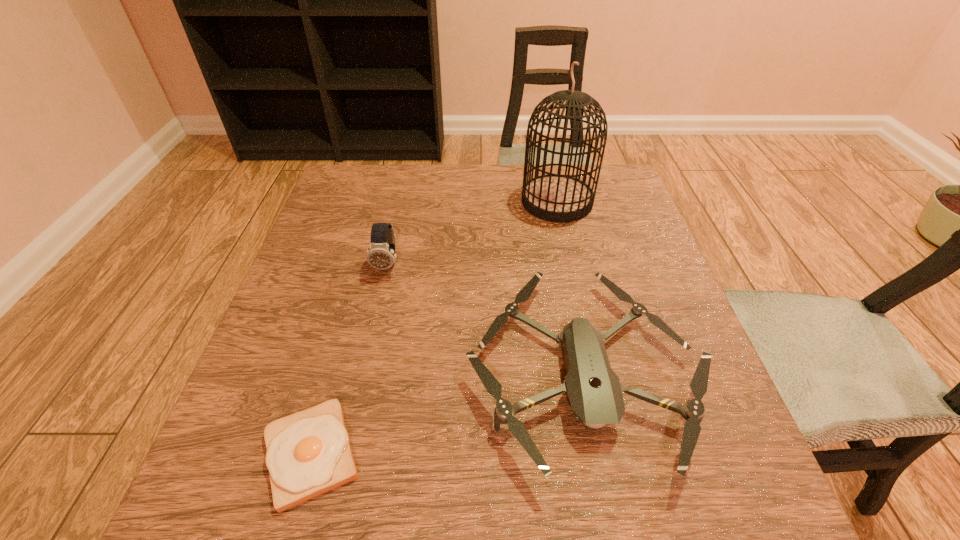
Identify the location of vacant space at the right edge of the desktop. This screenshot has height=540, width=960. (643, 303).

In order to click on vacant space at the far left corner of the desktop in this screenshot , I will do `click(365, 176)`.

I want to click on vacant area at the near left corner, so click(x=213, y=509).

In the image, there is a desktop. Where is `free space at the far right corner`? free space at the far right corner is located at coordinates (615, 209).

Where is `free area in between the farthest object and the second farthest object`? Image resolution: width=960 pixels, height=540 pixels. free area in between the farthest object and the second farthest object is located at coordinates (472, 233).

Where is `vacant area that lies between the shortest object and the farthest object`? The height and width of the screenshot is (540, 960). vacant area that lies between the shortest object and the farthest object is located at coordinates (434, 328).

This screenshot has height=540, width=960. Find the location of `free space between the shortest object and the drone`. free space between the shortest object and the drone is located at coordinates (447, 411).

You are a GUI agent. You are given a task and a screenshot of the screen. Output one action in this format:
    pyautogui.click(x=<x>, y=<y>)
    Task: Click on the free space between the second shortest object and the third shortest object
    Image resolution: width=960 pixels, height=540 pixels.
    Given the screenshot: What is the action you would take?
    pyautogui.click(x=485, y=317)

Find the location of a particular element. unoccupied position between the drone and the shortest object is located at coordinates (447, 411).

At what (x,y) coordinates should I click in order to perform the action: click on vacant region between the watch and the farthest object. Please return your answer as a coordinate pair (x, y). The height and width of the screenshot is (540, 960). Looking at the image, I should click on (472, 233).